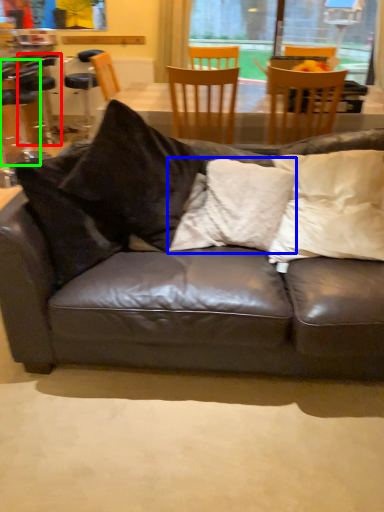
Question: Which is nearer to the bar stool (highlighted by a red box)? pillow (highlighted by a blue box) or chair (highlighted by a green box).

Choices:
 (A) pillow
 (B) chair

Answer: (B)